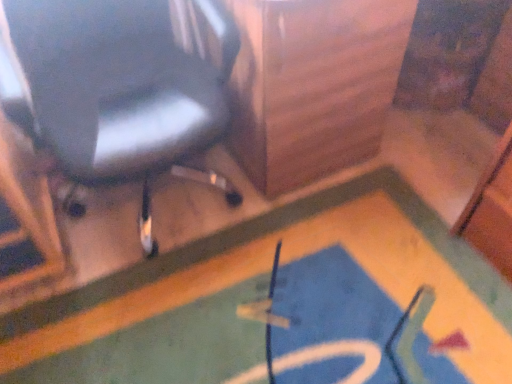
This screenshot has height=384, width=512. I want to click on blue carpet at lower center, so click(x=284, y=304).

Describe the element at coordinates (284, 304) in the screenshot. I see `blue carpet at lower center` at that location.

You are a GUI agent. You are given a task and a screenshot of the screen. Output one action in this format:
    pyautogui.click(x=<x>, y=<y>)
    Task: Click on the matte black chair at upper left
    The height and width of the screenshot is (384, 512).
    Given the screenshot: What is the action you would take?
    pyautogui.click(x=116, y=80)

The height and width of the screenshot is (384, 512). Describe the element at coordinates (116, 80) in the screenshot. I see `matte black chair at upper left` at that location.

Where is `blue carpet at lower center`? The image size is (512, 384). blue carpet at lower center is located at coordinates (284, 304).

Which is more to the left, matte black chair at upper left or blue carpet at lower center?

matte black chair at upper left.

Looking at this image, which object is closer to the camera taking this photo, matte black chair at upper left or blue carpet at lower center?

matte black chair at upper left.

Does point (118, 33) lie in front of point (384, 177)?

Yes.

From the image's perspective, which one is positioned higher, matte black chair at upper left or blue carpet at lower center?

From the image's view, matte black chair at upper left is above.

From a real-world perspective, is matte black chair at upper left under blue carpet at lower center?

Actually, matte black chair at upper left is physically above blue carpet at lower center in the real world.

Considering the relative sizes of matte black chair at upper left and blue carpet at lower center in the image provided, is matte black chair at upper left thinner than blue carpet at lower center?

Yes, matte black chair at upper left is thinner than blue carpet at lower center.

Does matte black chair at upper left have a greater height compared to blue carpet at lower center?

Yes.

Between matte black chair at upper left and blue carpet at lower center, which one has larger size?

matte black chair at upper left.

Is matte black chair at upper left located outside blue carpet at lower center?

That's correct, matte black chair at upper left is outside of blue carpet at lower center.

Is matte black chair at upper left next to blue carpet at lower center and touching it?

matte black chair at upper left and blue carpet at lower center are not in contact.

Does matte black chair at upper left turn towards blue carpet at lower center?

Yes, matte black chair at upper left faces towards blue carpet at lower center.

Identify the location of bath mat below the matte black chair at upper left (from the image's perspective). (284, 304).

Would you say blue carpet at lower center is to the left or to the right of matte black chair at upper left in the picture?

In the image, blue carpet at lower center appears on the right side of matte black chair at upper left.

Which is in front, blue carpet at lower center or matte black chair at upper left?

matte black chair at upper left.

Is point (431, 229) positioned in front of point (140, 134)?

No, (431, 229) is behind (140, 134).

From the image's perspective, would you say blue carpet at lower center is positioned over matte black chair at upper left?

No, from the image's perspective, blue carpet at lower center is not above matte black chair at upper left.

From a real-world perspective, is blue carpet at lower center on top of matte black chair at upper left?

No, from a real-world perspective, blue carpet at lower center is not over matte black chair at upper left

Considering the relative sizes of blue carpet at lower center and matte black chair at upper left in the image provided, is blue carpet at lower center thinner than matte black chair at upper left?

Incorrect, the width of blue carpet at lower center is not less than that of matte black chair at upper left.

Which of these two, blue carpet at lower center or matte black chair at upper left, stands shorter?

blue carpet at lower center is shorter.

In terms of size, does blue carpet at lower center appear bigger or smaller than matte black chair at upper left?

Considering their sizes, blue carpet at lower center takes up less space than matte black chair at upper left.

Based on the photo, would you say blue carpet at lower center is outside matte black chair at upper left?

Yes, blue carpet at lower center is not within matte black chair at upper left.

Is blue carpet at lower center with matte black chair at upper left?

No, blue carpet at lower center is not touching matte black chair at upper left.

Is blue carpet at lower center facing towards matte black chair at upper left?

No, blue carpet at lower center is not turned towards matte black chair at upper left.

What's the angular difference between blue carpet at lower center and matte black chair at upper left's facing directions?

The angle between the facing direction of blue carpet at lower center and the facing direction of matte black chair at upper left is 0.752 degrees.

How far apart are blue carpet at lower center and matte black chair at upper left?

blue carpet at lower center is 23.69 inches away from matte black chair at upper left.

Find the location of `chair located above the blue carpet at lower center (from a real-world perspective)`. chair located above the blue carpet at lower center (from a real-world perspective) is located at coordinates (116, 80).

Identify the location of chair that appears in front of the blue carpet at lower center. (116, 80).

You are a GUI agent. You are given a task and a screenshot of the screen. Output one action in this format:
    pyautogui.click(x=<x>, y=<y>)
    Task: Click on the bath mat behind the matte black chair at upper left
    This screenshot has height=384, width=512.
    Given the screenshot: What is the action you would take?
    pyautogui.click(x=284, y=304)